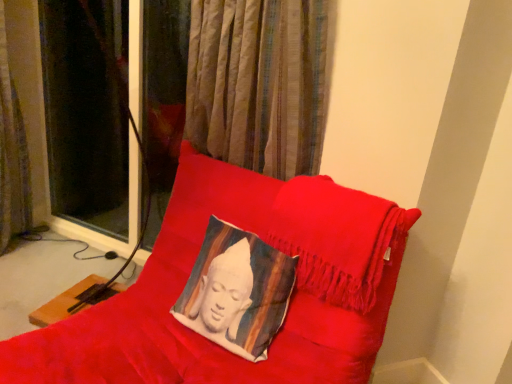
Question: In the image, is silky white cushion at center positioned in front of or behind velvet cushion at center?

Choices:
 (A) front
 (B) behind

Answer: (B)

Question: Is silky white cushion at center spatially inside velvet cushion at center, or outside of it?

Choices:
 (A) outside
 (B) inside

Answer: (B)

Question: Estimate the real-world distances between objects in this image. Which object is closer to the silky white cushion at center?

Choices:
 (A) brown textured curtain at left
 (B) velvet cushion at center

Answer: (B)

Question: Considering the real-world distances, which object is farthest from the silky white cushion at center?

Choices:
 (A) velvet cushion at center
 (B) brown textured curtain at left

Answer: (B)